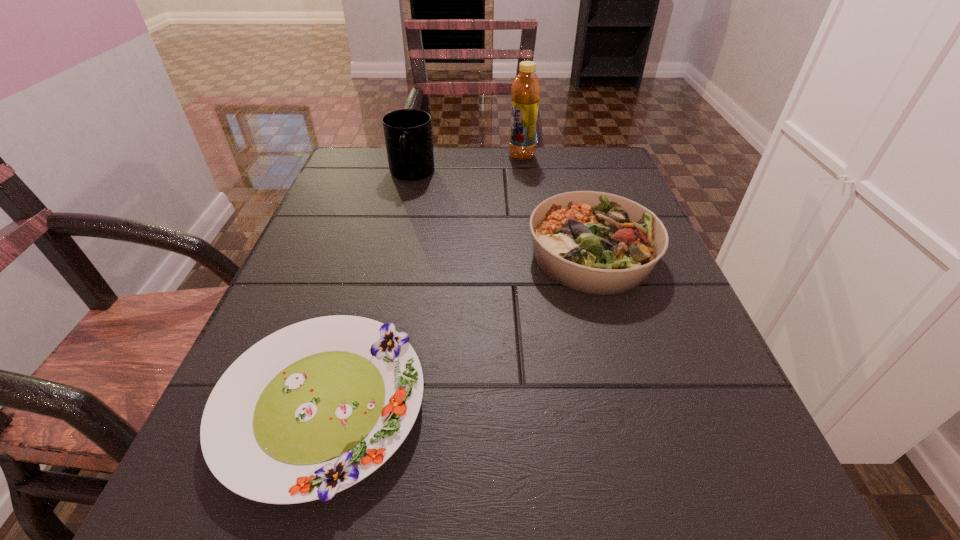
The height and width of the screenshot is (540, 960). I want to click on free space between the shorter salad plate and the farther salad plate, so click(457, 330).

This screenshot has width=960, height=540. What are the coordinates of `vacant area between the left salad plate and the tallest object` in the screenshot? It's located at (422, 281).

What are the coordinates of `vacant area that lies between the nearer salad plate and the tallest object` in the screenshot? It's located at (422, 281).

Identify which object is the closest to the taller salad plate. Please provide its 2D coordinates. Your answer should be formatted as a tuple, i.e. [(x, y)], where the tuple contains the x and y coordinates of a point satisfying the conditions above.

[(312, 409)]

The height and width of the screenshot is (540, 960). I want to click on object that is the third closest to the shortest object, so (x=526, y=88).

This screenshot has width=960, height=540. I want to click on free space that satisfies the following two spatial constraints: 1. on the side of the second tallest object with the handle; 2. on the left side of the second nearest object, so click(393, 255).

I want to click on free space that satisfies the following two spatial constraints: 1. on the back side of the nearer salad plate; 2. on the left side of the tallest object, so (397, 156).